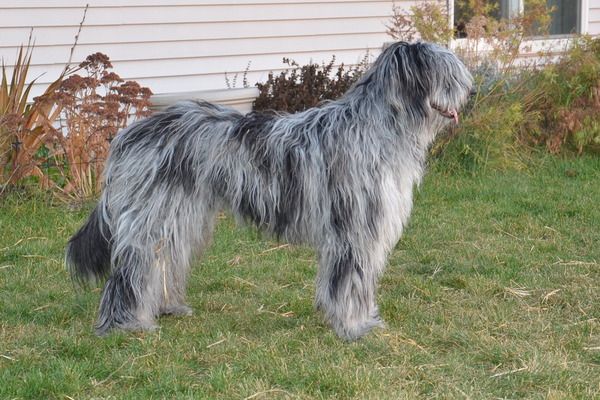
Image resolution: width=600 pixels, height=400 pixels. I want to click on white wooden walls, so click(x=236, y=30).